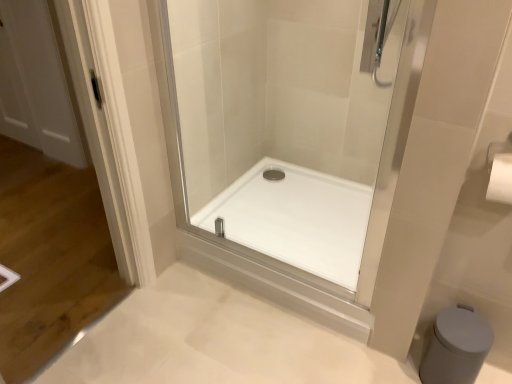
Question: In terms of width, does white glossy shower tray at center look wider or thinner when compared to white matte bidet at lower right?

Choices:
 (A) wide
 (B) thin

Answer: (A)

Question: From their relative heights in the image, would you say white glossy shower tray at center is taller or shorter than white matte bidet at lower right?

Choices:
 (A) short
 (B) tall

Answer: (A)

Question: Which is farther from the white glossy shower tray at center?

Choices:
 (A) white matte bidet at lower right
 (B) transparent glass shower door at center

Answer: (A)

Question: Estimate the real-world distances between objects in this image. Which object is farther from the white matte bidet at lower right?

Choices:
 (A) transparent glass shower door at center
 (B) white glossy shower tray at center

Answer: (A)